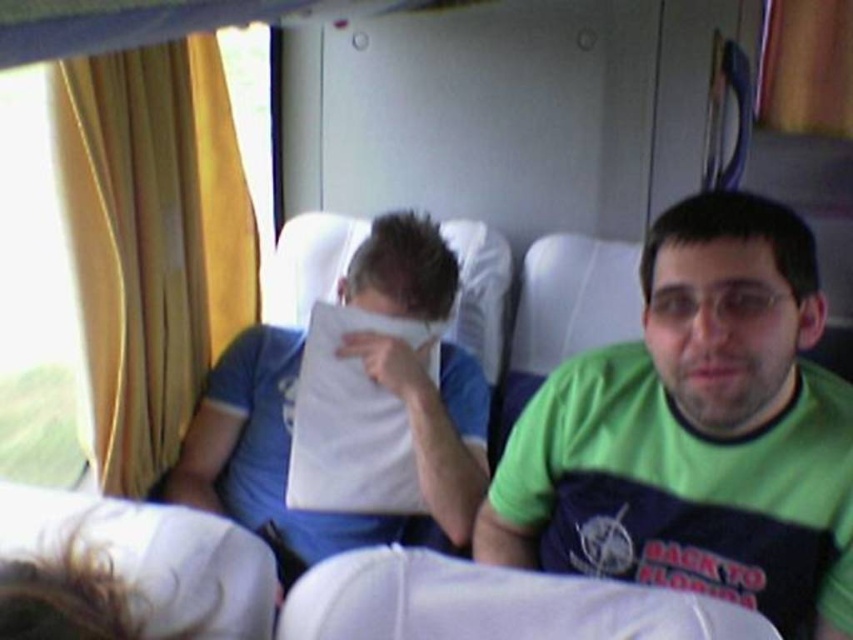
Question: Does green jersey at center have a smaller size compared to white paper at center?

Choices:
 (A) yes
 (B) no

Answer: (A)

Question: Is green jersey at center wider than white paper at center?

Choices:
 (A) no
 (B) yes

Answer: (A)

Question: Can you confirm if green jersey at center is positioned above white paper at center?

Choices:
 (A) no
 (B) yes

Answer: (A)

Question: Which point is farther from the camera taking this photo?

Choices:
 (A) tap(387, 214)
 (B) tap(624, 353)

Answer: (A)